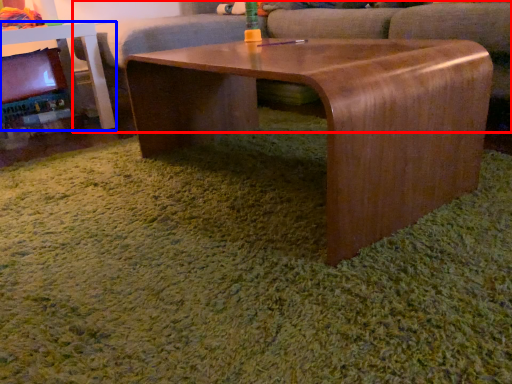
Question: Which point is closer to the camera, couch (highlighted by a red box) or table (highlighted by a blue box)?

Choices:
 (A) couch
 (B) table

Answer: (A)